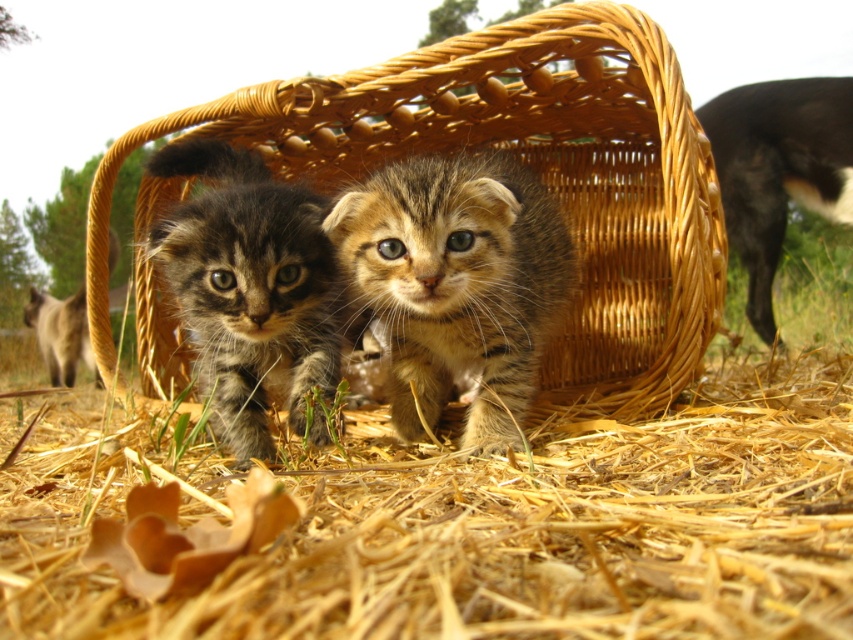
Question: Which object appears farthest from the camera in this image?

Choices:
 (A) black fur dog at upper right
 (B) striped fur kitten at center
 (C) dry straw at lower center

Answer: (A)

Question: Is dry straw at lower center positioned before striped fur kitten at center?

Choices:
 (A) yes
 (B) no

Answer: (A)

Question: Does woven straw basket at center lie in front of tabby fur kitten at center?

Choices:
 (A) no
 (B) yes

Answer: (A)

Question: Which point appears closest to the camera in this image?

Choices:
 (A) (291, 220)
 (B) (469, 451)
 (C) (752, 208)

Answer: (B)

Question: Which object is farther from the camera taking this photo?

Choices:
 (A) black fur dog at upper right
 (B) tabby fur kitten at center

Answer: (A)

Question: Can you confirm if woven straw basket at center is thinner than tabby fur kitten at center?

Choices:
 (A) no
 (B) yes

Answer: (A)